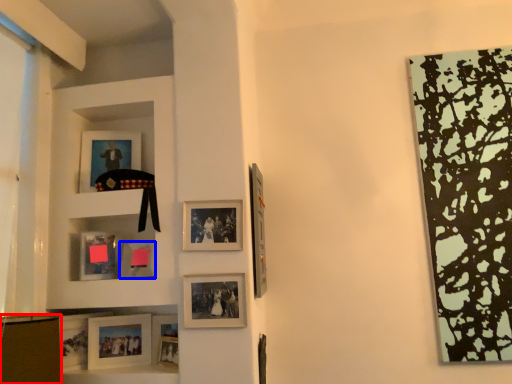
Question: Among these objects, which one is farthest to the camera, shelf (highlighted by a red box) or picture frame (highlighted by a blue box)?

Choices:
 (A) shelf
 (B) picture frame

Answer: (B)